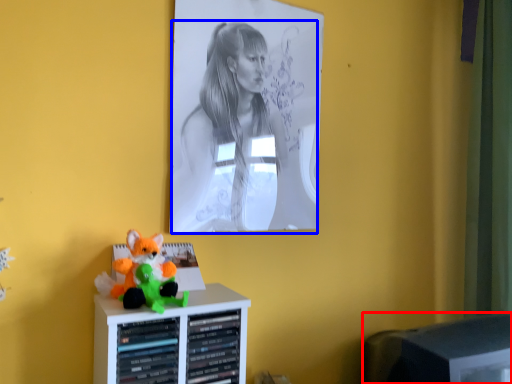
Question: Which object is further to the camera taking this photo, computer monitor (highlighted by a red box) or person (highlighted by a blue box)?

Choices:
 (A) computer monitor
 (B) person

Answer: (B)